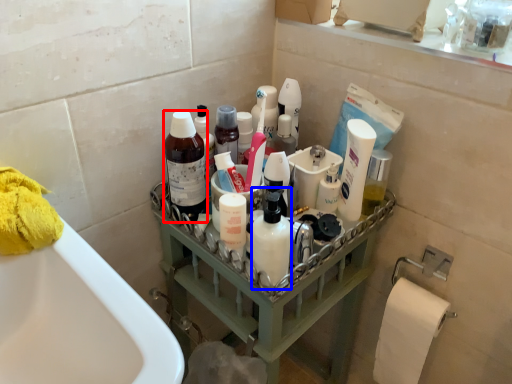
Question: Among these objects, which one is farthest to the camera, cleaning product (highlighted by a red box) or cleaning product (highlighted by a blue box)?

Choices:
 (A) cleaning product
 (B) cleaning product

Answer: (A)